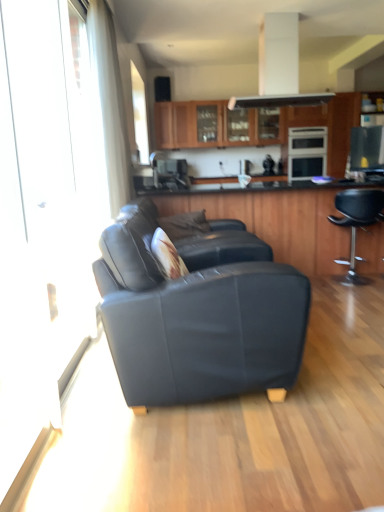
Where is `wooden cabinets at upper center, which is the 1th cabinetry from top to bottom`? The image size is (384, 512). wooden cabinets at upper center, which is the 1th cabinetry from top to bottom is located at coordinates (214, 125).

This screenshot has width=384, height=512. Describe the element at coordinates (214, 125) in the screenshot. I see `wooden cabinets at upper center, which is counted as the first cabinetry, starting from the back` at that location.

What do you see at coordinates (357, 222) in the screenshot? I see `black leather stool at right` at bounding box center [357, 222].

Locate an element on the screen. This screenshot has height=512, width=384. wooden cabinets at upper center, which is the 1th cabinetry from top to bottom is located at coordinates [x=214, y=125].

Looking at this image, is wooden cabinet at center, the first cabinetry ordered from the bottom, next to transparent glass screen door at left?

No.

At what (x,y) coordinates should I click in order to perform the action: click on the 1st cabinetry behind the transparent glass screen door at left. Please return your answer as a coordinate pair (x, y). The image size is (384, 512). Looking at the image, I should click on (276, 222).

Consider the image. Is wooden cabinet at center, which is the 1th cabinetry from front to back, inside or outside of transparent glass screen door at left?

wooden cabinet at center, which is the 1th cabinetry from front to back, is not inside transparent glass screen door at left, it's outside.

From a real-world perspective, is wooden cabinet at center, placed as the second cabinetry when sorted from back to front, above or below transparent glass screen door at left?

wooden cabinet at center, placed as the second cabinetry when sorted from back to front, is situated lower than transparent glass screen door at left in the real world.

Considering their positions, is matte black couch at center located in front of or behind wooden cabinet at center, the first cabinetry ordered from the bottom?

matte black couch at center is in front of wooden cabinet at center, the first cabinetry ordered from the bottom.

The height and width of the screenshot is (512, 384). I want to click on the 1st cabinetry above the matte black couch at center (from the image's perspective), so point(276,222).

Does matte black couch at center have a lesser width compared to wooden cabinet at center, placed as the second cabinetry when sorted from back to front?

Yes.

Could you tell me if matte black couch at center is turned towards wooden cabinet at center, acting as the second cabinetry starting from the top?

No, matte black couch at center is not oriented towards wooden cabinet at center, acting as the second cabinetry starting from the top.

Which of these two, satin black microwave at upper right, arranged as the 2th appliance when viewed from the back, or wooden cabinet at center, placed as the second cabinetry when sorted from back to front, is wider?

wooden cabinet at center, placed as the second cabinetry when sorted from back to front.

Which of these two, satin black microwave at upper right, the first appliance when ordered from front to back, or wooden cabinet at center, placed as the second cabinetry when sorted from back to front, is smaller?

satin black microwave at upper right, the first appliance when ordered from front to back, is smaller.

Is satin black microwave at upper right, which is counted as the second appliance, starting from the top, placed right next to wooden cabinet at center, placed as the second cabinetry when sorted from back to front?

satin black microwave at upper right, which is counted as the second appliance, starting from the top, and wooden cabinet at center, placed as the second cabinetry when sorted from back to front, are not in contact.

Which object is further away from the camera, satin black oven at center, which is counted as the second appliance, starting from the bottom, or black leather stool at right?

satin black oven at center, which is counted as the second appliance, starting from the bottom.

Is satin black oven at center, which is counted as the second appliance, starting from the bottom, next to black leather stool at right and touching it?

No.

Considering the relative sizes of satin black oven at center, which is the 1th appliance from top to bottom, and black leather stool at right in the image provided, is satin black oven at center, which is the 1th appliance from top to bottom, bigger than black leather stool at right?

Correct, satin black oven at center, which is the 1th appliance from top to bottom, is larger in size than black leather stool at right.

From the image's perspective, is satin black oven at center, the 1th appliance positioned from the back, on black leather stool at right?

Yes, from the image's perspective, satin black oven at center, the 1th appliance positioned from the back, is above black leather stool at right.

From a real-world perspective, who is located lower, satin black microwave at upper right, the first appliance when ordered from front to back, or wooden cabinets at upper center, placed as the second cabinetry when sorted from front to back?

satin black microwave at upper right, the first appliance when ordered from front to back, from a real-world perspective.

Considering the sizes of satin black microwave at upper right, arranged as the 2th appliance when viewed from the back, and wooden cabinets at upper center, arranged as the second cabinetry when ordered from the bottom, in the image, is satin black microwave at upper right, arranged as the 2th appliance when viewed from the back, wider or thinner than wooden cabinets at upper center, arranged as the second cabinetry when ordered from the bottom,?

In the image, satin black microwave at upper right, arranged as the 2th appliance when viewed from the back, appears to be more narrow than wooden cabinets at upper center, arranged as the second cabinetry when ordered from the bottom.

Considering the positions of objects satin black microwave at upper right, which appears as the first appliance when ordered from the bottom, and wooden cabinets at upper center, which is counted as the first cabinetry, starting from the back, in the image provided, who is more to the right, satin black microwave at upper right, which appears as the first appliance when ordered from the bottom, or wooden cabinets at upper center, which is counted as the first cabinetry, starting from the back,?

From the viewer's perspective, satin black microwave at upper right, which appears as the first appliance when ordered from the bottom, appears more on the right side.

Is satin black microwave at upper right, arranged as the 2th appliance when viewed from the back, located outside wooden cabinets at upper center, placed as the second cabinetry when sorted from front to back?

satin black microwave at upper right, arranged as the 2th appliance when viewed from the back, is positioned outside wooden cabinets at upper center, placed as the second cabinetry when sorted from front to back.

Can you confirm if transparent glass screen door at left is positioned to the left of satin black oven at center, which is the 1th appliance from top to bottom?

Yes, transparent glass screen door at left is to the left of satin black oven at center, which is the 1th appliance from top to bottom.

In the scene shown: Which of these two, transparent glass screen door at left or satin black oven at center, marked as the second appliance in a front-to-back arrangement, is smaller?

With smaller size is transparent glass screen door at left.

Is transparent glass screen door at left outside of satin black oven at center, which is the 1th appliance from top to bottom?

Yes.

Can you confirm if matte black couch at center is thinner than satin black microwave at upper right, which is counted as the second appliance, starting from the top?

Incorrect, the width of matte black couch at center is not less than that of satin black microwave at upper right, which is counted as the second appliance, starting from the top.

Consider the image. From a real-world perspective, is matte black couch at center positioned above or below satin black microwave at upper right, which is counted as the second appliance, starting from the top?

matte black couch at center is situated lower than satin black microwave at upper right, which is counted as the second appliance, starting from the top, in the real world.

Who is taller, matte black couch at center or satin black microwave at upper right, arranged as the 2th appliance when viewed from the back?

matte black couch at center.

Could you tell me if matte black couch at center is turned towards satin black microwave at upper right, arranged as the 2th appliance when viewed from the back?

No, matte black couch at center is not oriented towards satin black microwave at upper right, arranged as the 2th appliance when viewed from the back.

Which cabinetry is the 2nd one when counting from the right side of the transparent glass screen door at left? Please provide its 2D coordinates.

[(276, 222)]

Identify the location of studio couch directly beneath the wooden cabinet at center, which is the 1th cabinetry from front to back (from a real-world perspective). Image resolution: width=384 pixels, height=512 pixels. (198, 313).

Looking at the image, which one is located further to wooden cabinet at center, placed as the second cabinetry when sorted from back to front, matte black couch at center or black leather stool at right?

The object further to wooden cabinet at center, placed as the second cabinetry when sorted from back to front, is matte black couch at center.

From the image, which object appears to be farther from wooden cabinets at upper center, which is counted as the first cabinetry, starting from the back, matte black couch at center or transparent glass screen door at left?

The object further to wooden cabinets at upper center, which is counted as the first cabinetry, starting from the back, is transparent glass screen door at left.

When comparing their distances from satin black oven at center, which is counted as the second appliance, starting from the bottom, does black leather stool at right or wooden cabinets at upper center, which is counted as the first cabinetry, starting from the back, seem further?

Based on the image, black leather stool at right appears to be further to satin black oven at center, which is counted as the second appliance, starting from the bottom.

In the scene shown: Based on their spatial positions, is satin black microwave at upper right, the first appliance when ordered from front to back, or black leather stool at right closer to wooden cabinets at upper center, which is the 1th cabinetry from top to bottom?

The object closer to wooden cabinets at upper center, which is the 1th cabinetry from top to bottom, is satin black microwave at upper right, the first appliance when ordered from front to back.

Which object lies further to the anchor point matte black couch at center, black leather stool at right or satin black oven at center, marked as the second appliance in a front-to-back arrangement?

satin black oven at center, marked as the second appliance in a front-to-back arrangement, is positioned further to the anchor matte black couch at center.

Considering their positions, is satin black microwave at upper right, the first appliance when ordered from front to back, positioned further to wooden cabinet at center, acting as the second cabinetry starting from the top, than satin black oven at center, which is counted as the second appliance, starting from the bottom?

Among the two, satin black oven at center, which is counted as the second appliance, starting from the bottom, is located further to wooden cabinet at center, acting as the second cabinetry starting from the top.

Looking at the image, which one is located further to black leather stool at right, satin black microwave at upper right, arranged as the 2th appliance when viewed from the back, or satin black oven at center, which is counted as the second appliance, starting from the bottom?

satin black oven at center, which is counted as the second appliance, starting from the bottom.

When comparing their distances from black leather stool at right, does satin black oven at center, which is the 1th appliance from top to bottom, or satin black microwave at upper right, arranged as the 2th appliance when viewed from the back, seem closer?

satin black microwave at upper right, arranged as the 2th appliance when viewed from the back, is positioned closer to the anchor black leather stool at right.

Locate an element on the screen. chair between matte black couch at center and wooden cabinets at upper center, placed as the second cabinetry when sorted from front to back, from front to back is located at coordinates (357, 222).

The width and height of the screenshot is (384, 512). In order to click on chair located between transparent glass screen door at left and wooden cabinet at center, placed as the second cabinetry when sorted from back to front, in the depth direction in this screenshot , I will do tap(357, 222).

Find the location of a particular element. The image size is (384, 512). cabinetry between transparent glass screen door at left and satin black oven at center, the 1th appliance positioned from the back, in the front-back direction is located at coordinates (276, 222).

Image resolution: width=384 pixels, height=512 pixels. In order to click on cabinetry positioned between black leather stool at right and wooden cabinets at upper center, placed as the second cabinetry when sorted from front to back, from near to far in this screenshot , I will do `click(276, 222)`.